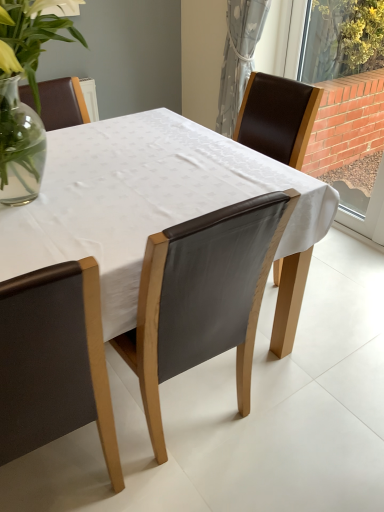
This screenshot has height=512, width=384. Identify the location of vacant space in front of leather at center, arranged as the first chair when viewed from the right. (213, 487).